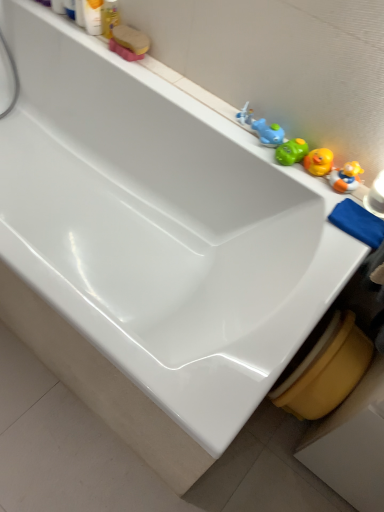
Question: From a real-world perspective, is white plastic toy at upper right, arranged as the 3th toy when viewed from the right, physically located above or below blue rubber duck at upper right, which appears as the 3th toy when viewed from the top?

Choices:
 (A) below
 (B) above

Answer: (A)

Question: Considering the positions of white plastic toy at upper right, the second toy in the left-to-right sequence, and blue rubber duck at upper right, the second toy from the right, in the image, is white plastic toy at upper right, the second toy in the left-to-right sequence, bigger or smaller than blue rubber duck at upper right, the second toy from the right,?

Choices:
 (A) small
 (B) big

Answer: (A)

Question: Estimate the real-world distances between objects in this image. Which object is closer to the yellow matte plastic toilet bowl at lower right?

Choices:
 (A) green rubber duck at upper right, which is the 4th toy in left-to-right order
 (B) blue rubber duck at upper right, which appears as the 3th toy when viewed from the top
 (C) matte plastic bottle at upper left, arranged as the first toiletry when viewed from the left
 (D) matte plastic soap at upper left, which is counted as the 1th toiletry, starting from the right
 (E) blue cloth at right

Answer: (E)

Question: Considering the real-world distances, which object is closest to the matte plastic bottle at upper left, arranged as the first toiletry when viewed from the left?

Choices:
 (A) white plastic toy at upper right, the third toy when ordered from bottom to top
 (B) green rubber duck at upper right, placed as the 1th toy when sorted from bottom to top
 (C) blue rubber duck at upper right, placed as the 2th toy when sorted from bottom to top
 (D) yellow matte plastic toilet bowl at lower right
 (E) blue cloth at right

Answer: (A)